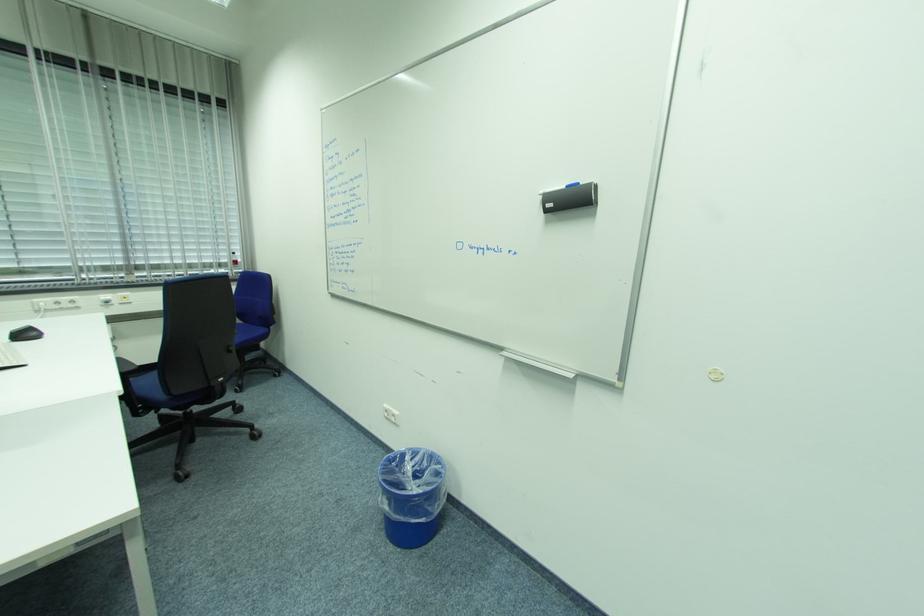
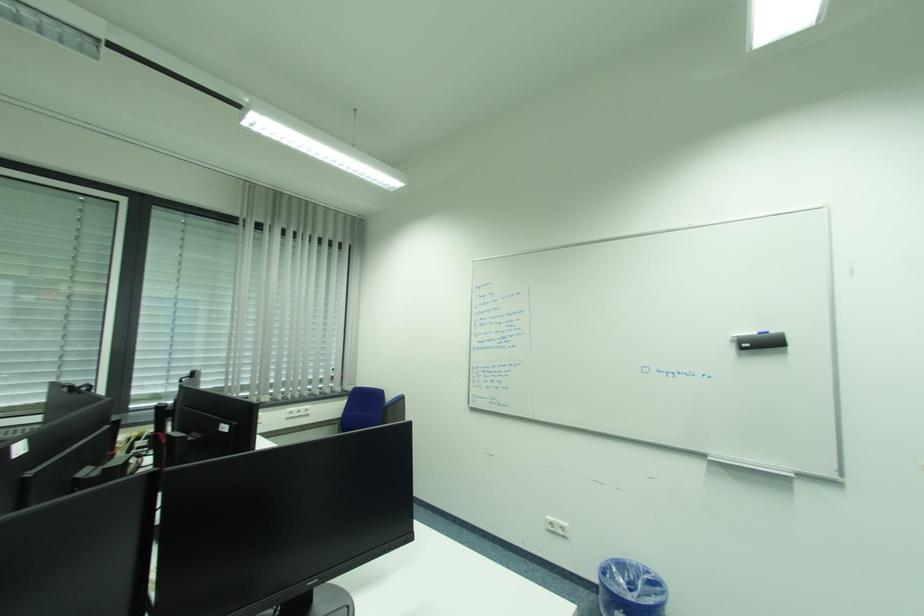
Question: Which direction would the cameraman need to move to produce the second image? Reply with the corresponding letter.

Choices:
 (A) Left
 (B) Right
 (C) Forward
 (D) Backward

Answer: (A)